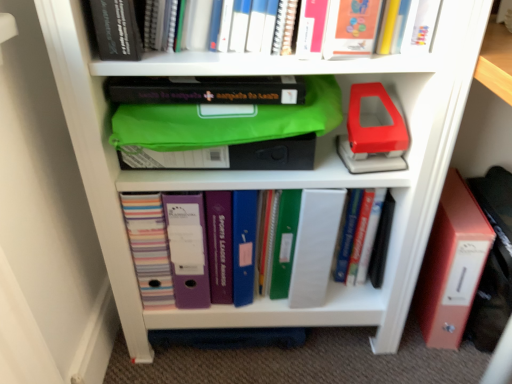
Question: Does hardcover book at upper left, which ranks as the first book in front-to-back order, have a lesser height compared to matte plastic folders at center, positioned as the first book in bottom-to-top order?

Choices:
 (A) yes
 (B) no

Answer: (A)

Question: Is hardcover book at upper left, which appears as the second book when viewed from the back, far away from matte plastic folders at center, which is the 2th book from top to bottom?

Choices:
 (A) yes
 (B) no

Answer: (B)

Question: Is matte plastic folders at center, which is the 2th book from top to bottom, inside hardcover book at upper left, which is the 1th book in top-to-bottom order?

Choices:
 (A) yes
 (B) no

Answer: (B)

Question: Could you tell me if hardcover book at upper left, which appears as the second book when viewed from the back, is turned towards matte plastic folders at center, arranged as the 1th book when viewed from the back?

Choices:
 (A) no
 (B) yes

Answer: (A)

Question: Can you confirm if hardcover book at upper left, which appears as the second book when viewed from the back, is wider than matte plastic folders at center, placed as the 2th book when sorted from front to back?

Choices:
 (A) no
 (B) yes

Answer: (B)

Question: Is hardcover book at upper left, which is the 1th book in top-to-bottom order, next to matte plastic folders at center, positioned as the first book in bottom-to-top order, and touching it?

Choices:
 (A) yes
 (B) no

Answer: (B)

Question: Are matte plastic folders at center, arranged as the 1th book when viewed from the back, and hardcover book at upper left, which appears as the second book when viewed from the back, far apart?

Choices:
 (A) no
 (B) yes

Answer: (A)

Question: Is matte plastic folders at center, which is the 2th book from top to bottom, touching hardcover book at upper left, which ranks as the first book in front-to-back order?

Choices:
 (A) yes
 (B) no

Answer: (B)

Question: Is matte plastic folders at center, arranged as the 1th book when viewed from the back, in front of hardcover book at upper left, which is the 1th book in top-to-bottom order?

Choices:
 (A) yes
 (B) no

Answer: (B)

Question: Considering the relative sizes of matte plastic folders at center, positioned as the first book in bottom-to-top order, and hardcover book at upper left, which ranks as the first book in front-to-back order, in the image provided, is matte plastic folders at center, positioned as the first book in bottom-to-top order, thinner than hardcover book at upper left, which ranks as the first book in front-to-back order,?

Choices:
 (A) yes
 (B) no

Answer: (A)

Question: Does matte plastic folders at center, which is the 2th book from top to bottom, appear on the left side of hardcover book at upper left, which is the 2th book from bottom to top?

Choices:
 (A) yes
 (B) no

Answer: (B)

Question: Considering the relative sizes of matte plastic folders at center, placed as the 2th book when sorted from front to back, and hardcover book at upper left, which appears as the second book when viewed from the back, in the image provided, is matte plastic folders at center, placed as the 2th book when sorted from front to back, wider than hardcover book at upper left, which appears as the second book when viewed from the back,?

Choices:
 (A) no
 (B) yes

Answer: (A)

Question: Is point (98, 14) closer or farther from the camera than point (321, 200)?

Choices:
 (A) farther
 (B) closer

Answer: (B)